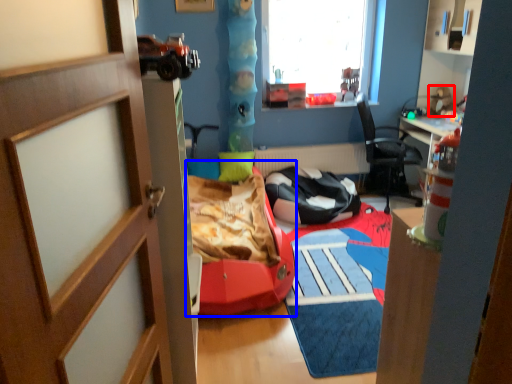
Question: Which of the following is the closest to the observer, toy (highlighted by a red box) or bed frame (highlighted by a blue box)?

Choices:
 (A) toy
 (B) bed frame

Answer: (B)